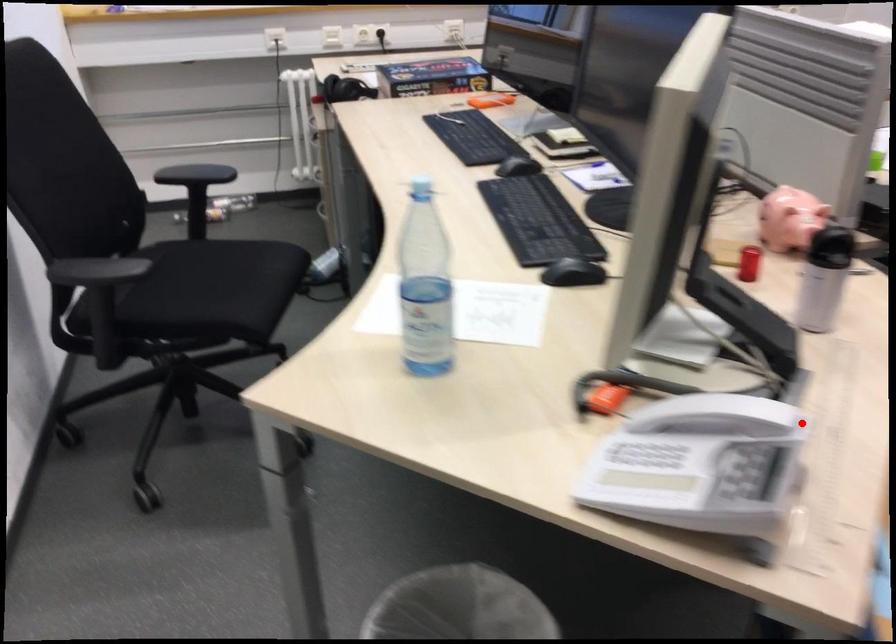
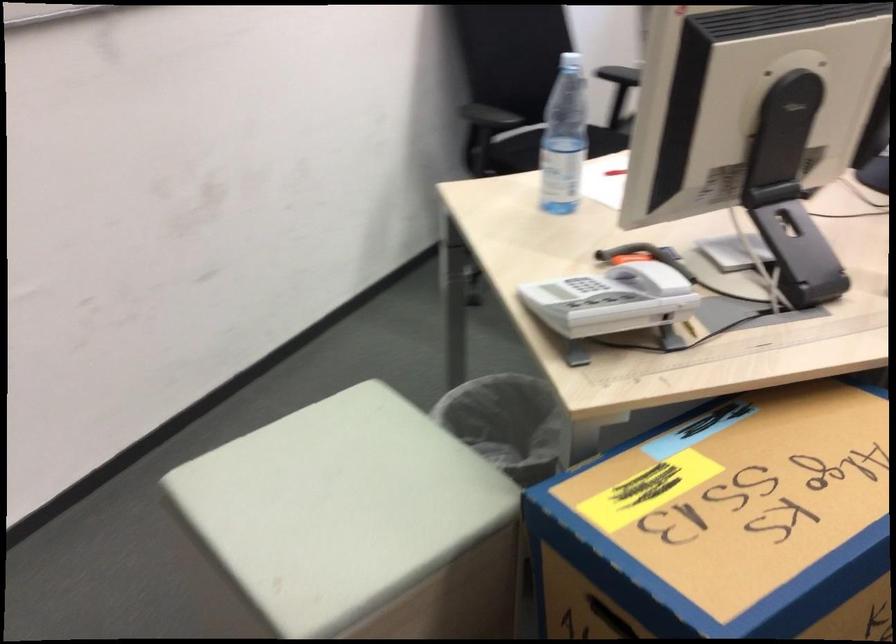
In the second image, find the point that corresponds to the highlighted location in the first image.

(746, 334)